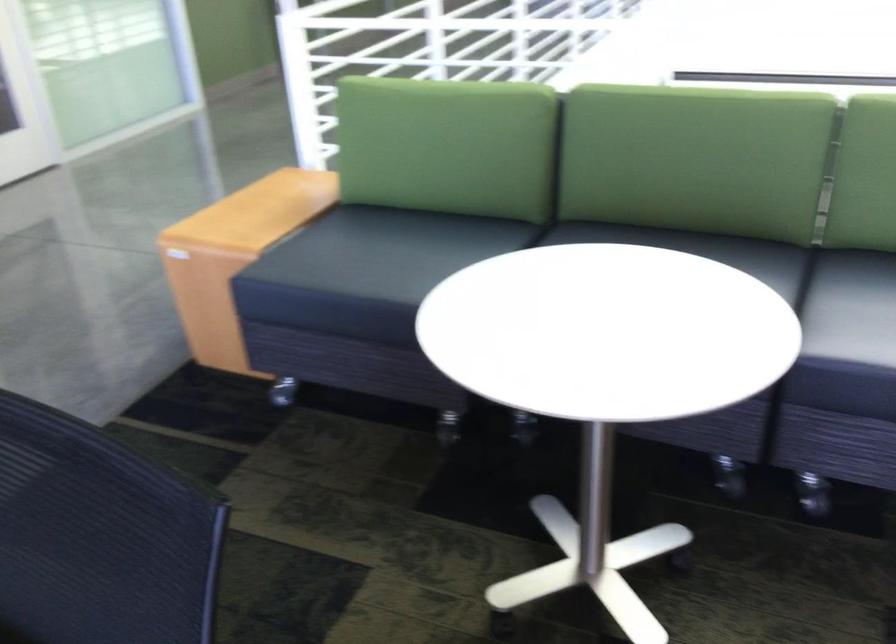
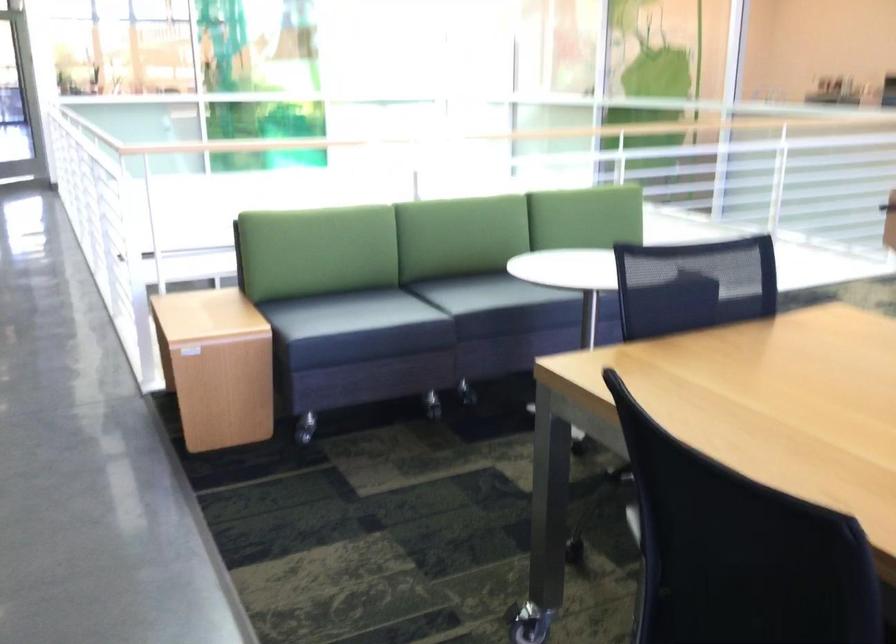
Find the pixel in the second image that matches (x=91, y=532) in the first image.

(695, 275)